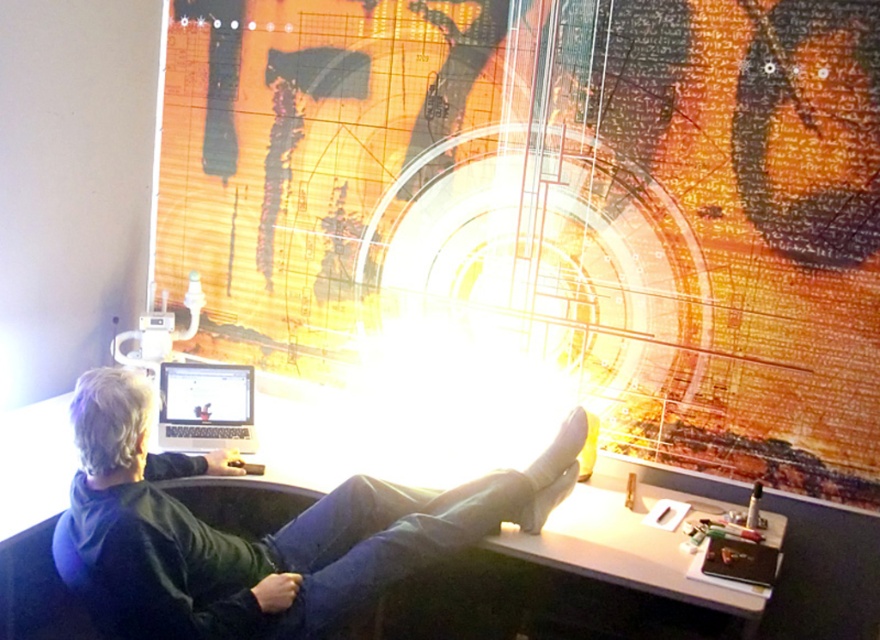
Question: Is black leather jacket at center to the left of satin black laptop at lower left from the viewer's perspective?

Choices:
 (A) yes
 (B) no

Answer: (B)

Question: Is matte orange poster at upper center wider than satin black laptop at lower left?

Choices:
 (A) yes
 (B) no

Answer: (A)

Question: Which point is closer to the camera?

Choices:
 (A) matte orange poster at upper center
 (B) satin black laptop at lower left

Answer: (A)

Question: Can you confirm if black leather jacket at center is positioned to the left of satin black laptop at lower left?

Choices:
 (A) no
 (B) yes

Answer: (A)

Question: Which of the following is the farthest from the observer?

Choices:
 (A) matte orange poster at upper center
 (B) black leather jacket at center
 (C) satin black laptop at lower left

Answer: (C)

Question: Which point is farther to the camera?

Choices:
 (A) (186, 406)
 (B) (368, 486)

Answer: (A)